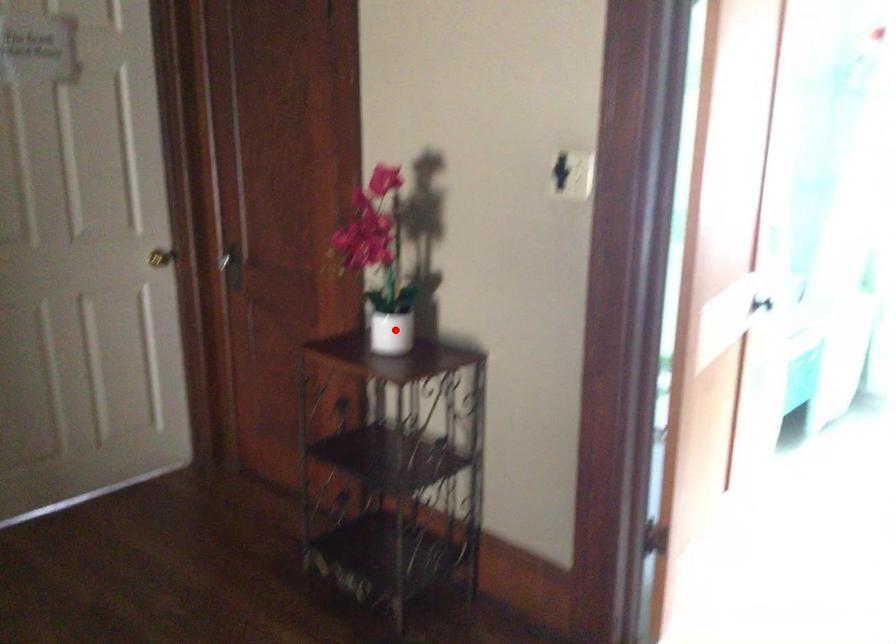
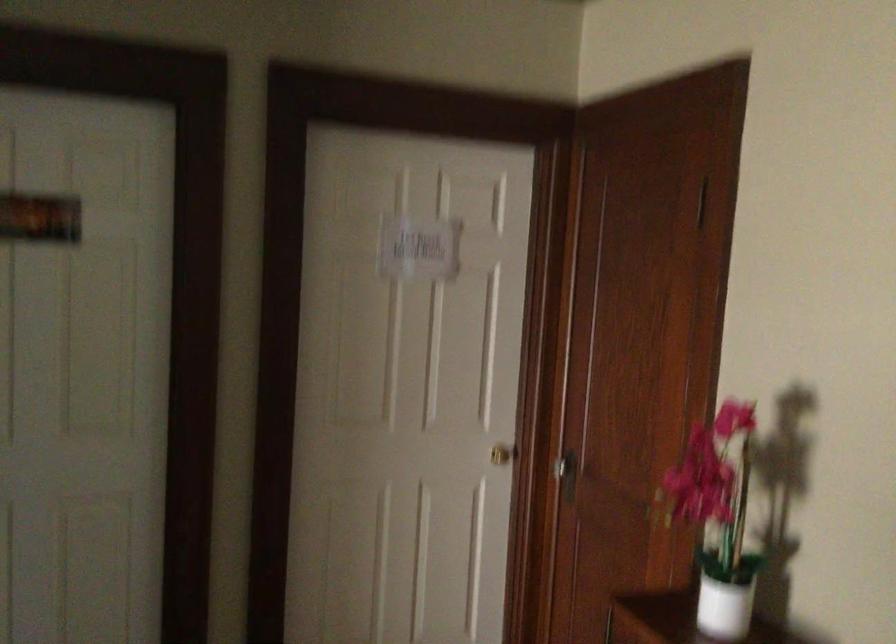
Locate, in the second image, the point that corresponds to the highlighted location in the first image.

(725, 607)